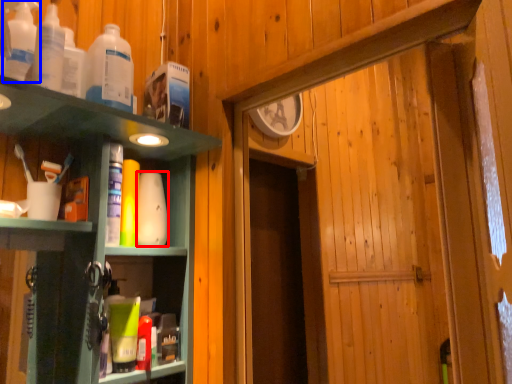
Question: Which point is further to the camera, toiletry (highlighted by a red box) or bottle (highlighted by a blue box)?

Choices:
 (A) toiletry
 (B) bottle

Answer: (A)